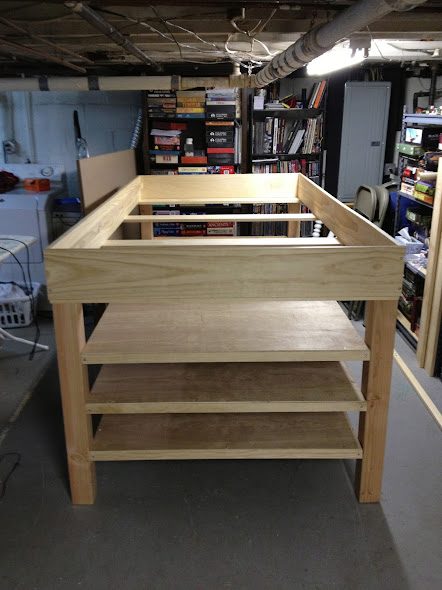
Identify the location of wooden leg. (372, 472).